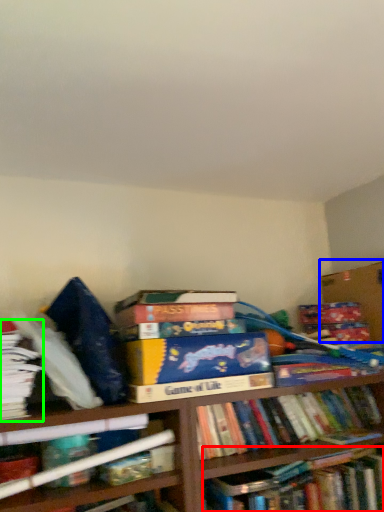
Question: Based on their relative distances, which object is nearer to book (highlighted by a red box)? Choose from cardboard box (highlighted by a blue box) and book (highlighted by a green box).

Choices:
 (A) cardboard box
 (B) book

Answer: (A)